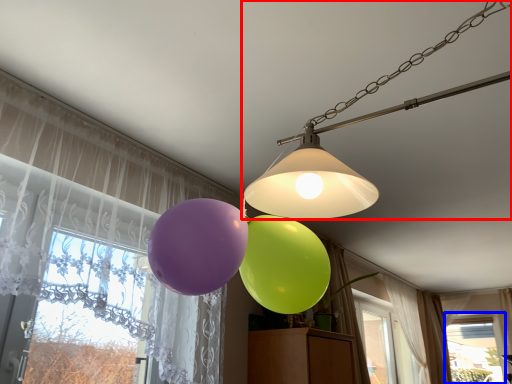
Question: Which object appears closest to the camera in this image, lamp (highlighted by a red box) or window (highlighted by a blue box)?

Choices:
 (A) lamp
 (B) window

Answer: (A)